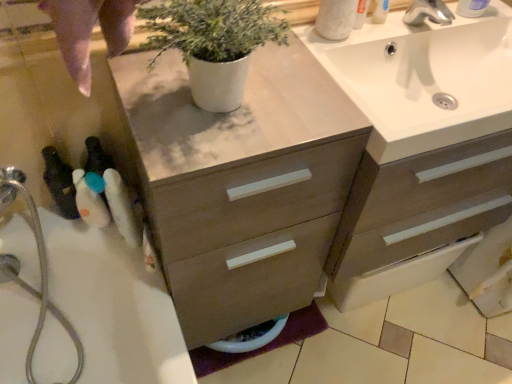
Identify the location of free space in front of white matte toilet paper at upper right. (335, 82).